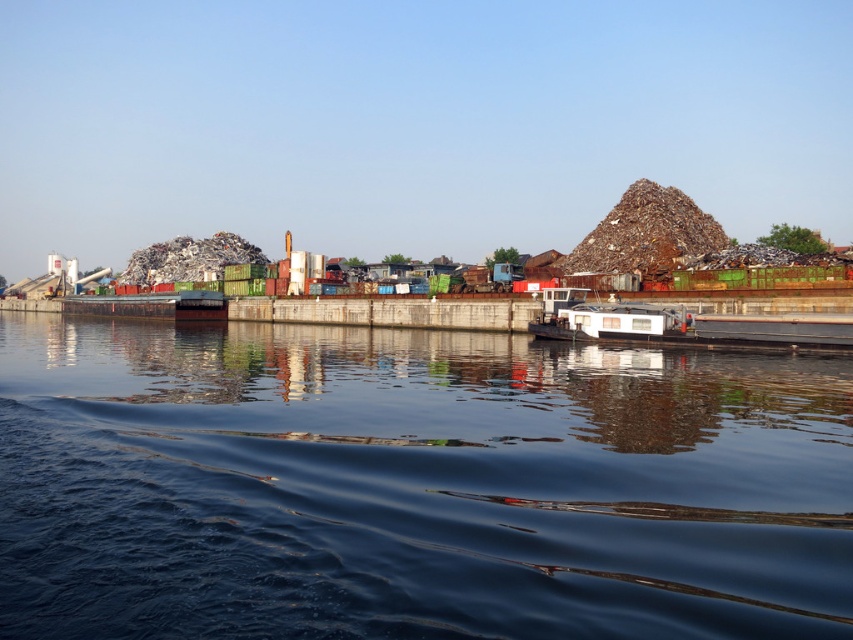
You are standing on the concrete wall and see the dark blue water at center and the white matte houseboat at center. Which object is located more to the left?

The dark blue water at center is positioned on the left side of white matte houseboat at center, so the dark blue water at center is more to the left.

You are planning to dock your small boat at the waterfront scene. The boat requires a space larger than the white matte houseboat at center to maneuver safely. Is the dark blue water at center sufficient for your needs?

The dark blue water at center is larger in size than the white matte houseboat at center, so yes, the dark blue water at center provides enough space for your boat to maneuver safely.

You are standing on the concrete wall and looking at the dark blue water at center and the white matte houseboat at center. Which object is located above the other?

The white matte houseboat at center is above the dark blue water at center because the dark blue water at center is positioned under it.